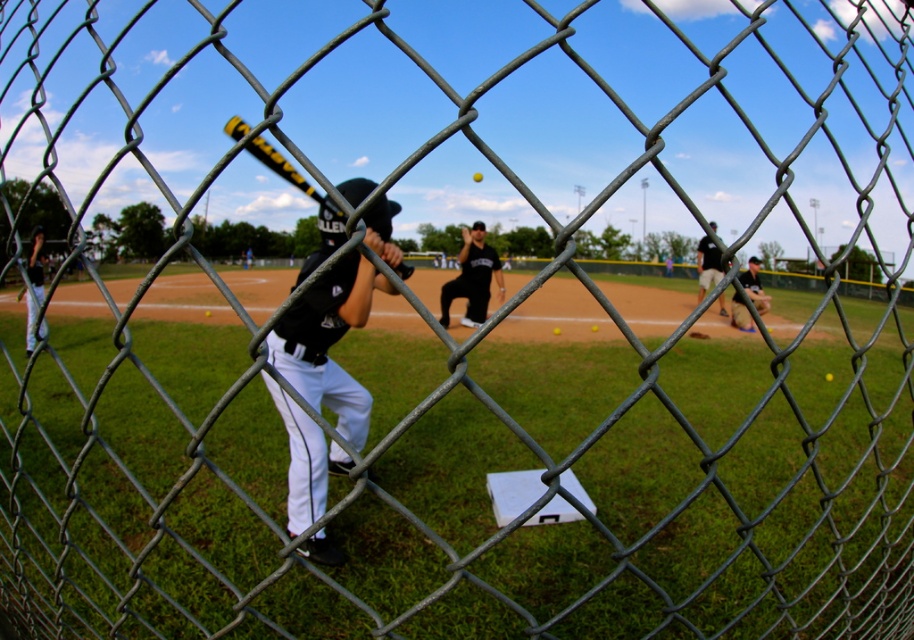
Is yellow/black textured bat at center closer to camera compared to yellow matte baseball at center?

Yes, it is in front of yellow matte baseball at center.

Is yellow/black textured bat at center shorter than yellow matte baseball at center?

In fact, yellow/black textured bat at center may be taller than yellow matte baseball at center.

In order to click on yellow/black textured bat at center in this screenshot , I will do `click(283, 168)`.

What are the coordinates of `yellow/black textured bat at center` in the screenshot? It's located at (283, 168).

Which of these two, black uniform at lower right or dark gray uniform at center, stands taller?

With more height is dark gray uniform at center.

Is black uniform at lower right thinner than dark gray uniform at center?

Yes, black uniform at lower right is thinner than dark gray uniform at center.

Locate an element on the screen. The width and height of the screenshot is (914, 640). black uniform at lower right is located at coordinates (753, 285).

The width and height of the screenshot is (914, 640). Identify the location of black uniform at lower right. (753, 285).

Which is behind, point (322, 312) or point (474, 176)?

The point (474, 176) is more distant.

Looking at this image, how much distance is there between black matte uniform at center and yellow matte baseball at center?

black matte uniform at center and yellow matte baseball at center are 26.22 meters apart.

The height and width of the screenshot is (640, 914). What are the coordinates of `black matte uniform at center` in the screenshot? It's located at (328, 340).

You are a GUI agent. You are given a task and a screenshot of the screen. Output one action in this format:
    pyautogui.click(x=<x>, y=<y>)
    Task: Click on the black matte uniform at center
    
    Given the screenshot: What is the action you would take?
    pyautogui.click(x=328, y=340)